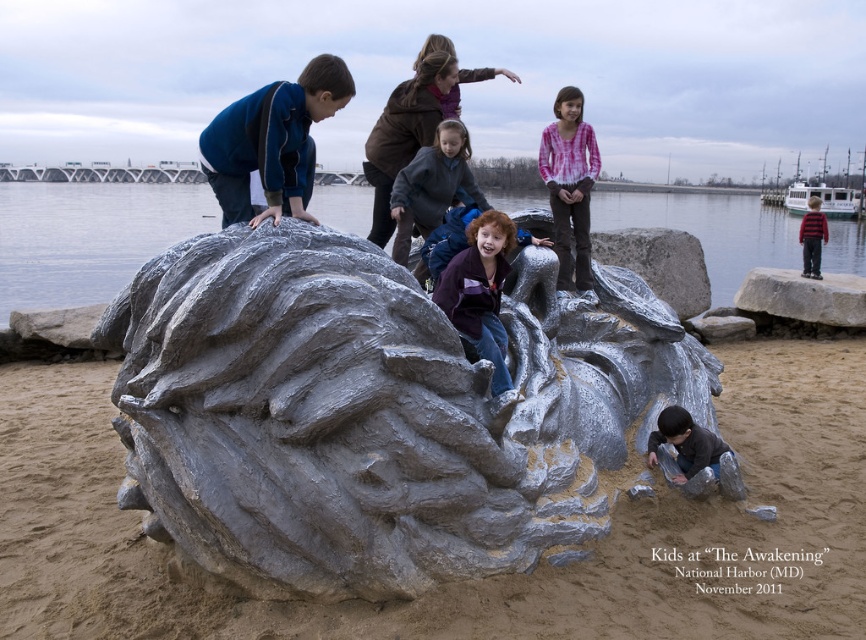
Question: Which of these objects is positioned farthest from the striped wool sweater at upper right?

Choices:
 (A) pink tie-dye shirt at upper center
 (B) gray stone sculpture at center
 (C) matte gray jacket at center
 (D) matte purple jacket at center

Answer: (B)

Question: Which point is farther from the camera taking this photo?

Choices:
 (A) (716, 467)
 (B) (305, 156)
 (C) (792, 301)

Answer: (C)

Question: Is matte purple jacket at center to the left of striped wool sweater at upper right from the viewer's perspective?

Choices:
 (A) no
 (B) yes

Answer: (B)

Question: Does gray metallic water at center have a smaller size compared to matte brown jacket at upper center?

Choices:
 (A) yes
 (B) no

Answer: (B)

Question: Does matte gray jacket at center have a lesser width compared to striped wool sweater at upper right?

Choices:
 (A) yes
 (B) no

Answer: (A)

Question: Which object is closer to the camera taking this photo?

Choices:
 (A) gray stone sculpture at center
 (B) matte blue jacket at upper left

Answer: (A)